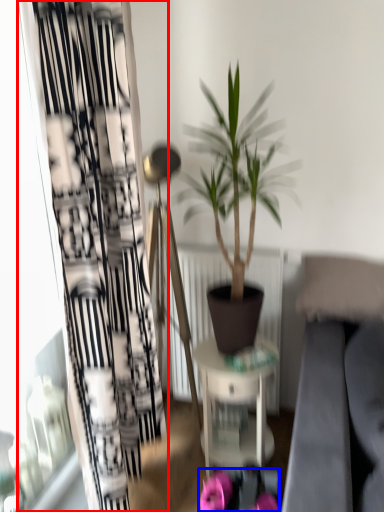
Question: Which object is further to the camera taking this photo, curtain (highlighted by a red box) or flower (highlighted by a blue box)?

Choices:
 (A) curtain
 (B) flower

Answer: (B)